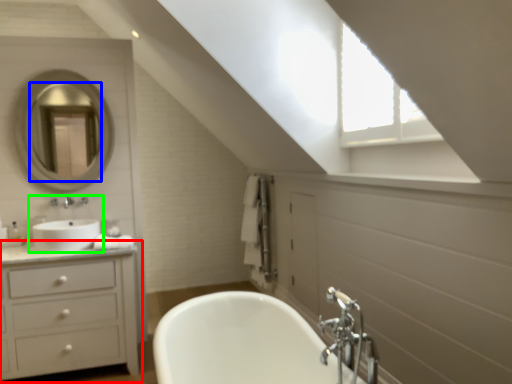
Question: Which object is positioned closest to bathroom cabinet (highlighted by a red box)? Select from mirror (highlighted by a blue box) and sink (highlighted by a green box).

Choices:
 (A) mirror
 (B) sink

Answer: (B)